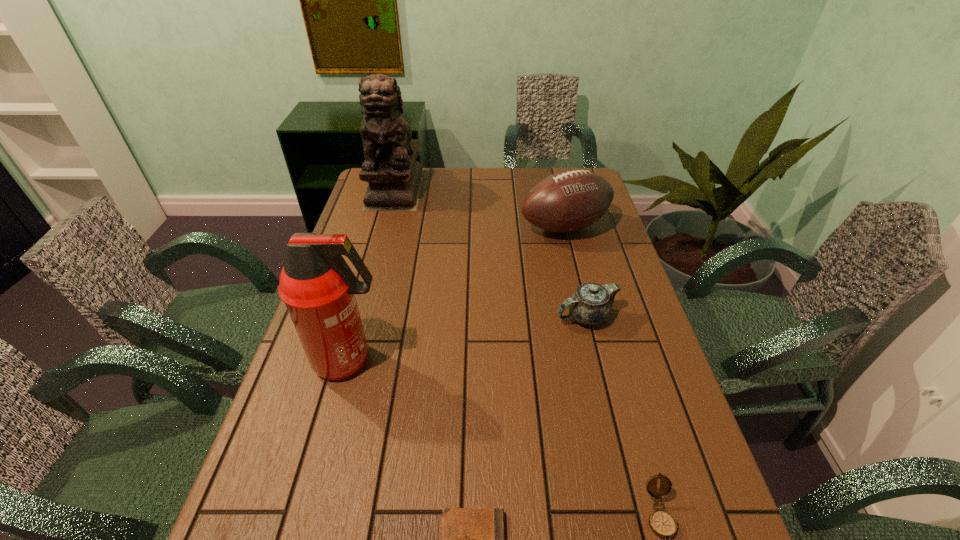
At what (x,y) coordinates should I click in order to perform the action: click on vacant space located from the spout of the chinaware. Please return your answer as a coordinate pair (x, y). The image size is (960, 540). Looking at the image, I should click on (493, 317).

Where is `object that is positioned at the far edge`? The width and height of the screenshot is (960, 540). object that is positioned at the far edge is located at coordinates (394, 176).

The image size is (960, 540). What are the coordinates of `sculpture positioned at the left edge` in the screenshot? It's located at (394, 176).

The image size is (960, 540). Identify the location of fire extinguisher present at the left edge. (316, 284).

Identify the location of football (American) present at the right edge. This screenshot has width=960, height=540. (570, 200).

In order to click on chinaware present at the right edge in this screenshot , I will do `click(591, 304)`.

Where is `object positioned at the far left corner`? object positioned at the far left corner is located at coordinates (394, 176).

In the image, there is a desktop. Identify the location of free space at the far edge. The width and height of the screenshot is (960, 540). (465, 187).

Where is `vacant region at the left edge of the desktop`? Image resolution: width=960 pixels, height=540 pixels. vacant region at the left edge of the desktop is located at coordinates (283, 440).

This screenshot has height=540, width=960. What are the coordinates of `free space at the right edge of the desktop` in the screenshot? It's located at (612, 369).